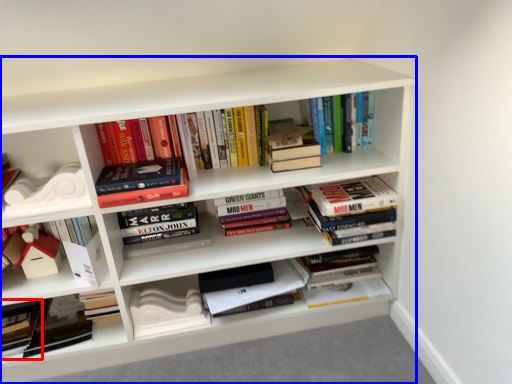
Question: Among these objects, which one is farthest to the camera, paperback book (highlighted by a red box) or shelf (highlighted by a blue box)?

Choices:
 (A) paperback book
 (B) shelf

Answer: (A)